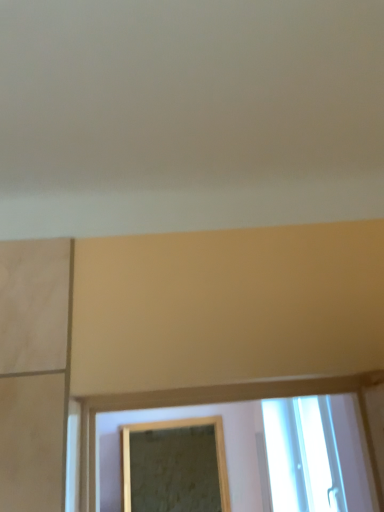
Question: Is gold-framed mirror at center wider or thinner than transparent glass window at lower right?

Choices:
 (A) wide
 (B) thin

Answer: (A)

Question: Is gold-framed mirror at center bigger or smaller than transparent glass window at lower right?

Choices:
 (A) small
 (B) big

Answer: (B)

Question: From a real-world perspective, relative to transparent glass window at lower right, is gold-framed mirror at center vertically above or below?

Choices:
 (A) below
 (B) above

Answer: (A)

Question: Is transparent glass window at lower right inside the boundaries of gold-framed mirror at center, or outside?

Choices:
 (A) inside
 (B) outside

Answer: (B)

Question: Considering their positions, is transparent glass window at lower right located in front of or behind gold-framed mirror at center?

Choices:
 (A) front
 (B) behind

Answer: (A)

Question: Is transparent glass window at lower right bigger or smaller than gold-framed mirror at center?

Choices:
 (A) big
 (B) small

Answer: (B)

Question: Considering the positions of transparent glass window at lower right and gold-framed mirror at center in the image, is transparent glass window at lower right taller or shorter than gold-framed mirror at center?

Choices:
 (A) short
 (B) tall

Answer: (A)